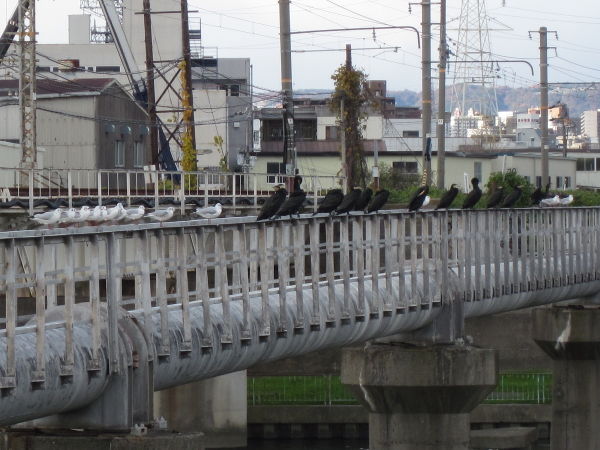
You are a GUI agent. You are given a task and a screenshot of the screen. Output one action in this format:
    pyautogui.click(x=<x>, y=<y>)
    Task: Click on the windows
    The width and height of the screenshot is (600, 450).
    Given the screenshot: What is the action you would take?
    pyautogui.click(x=118, y=154), pyautogui.click(x=137, y=154)